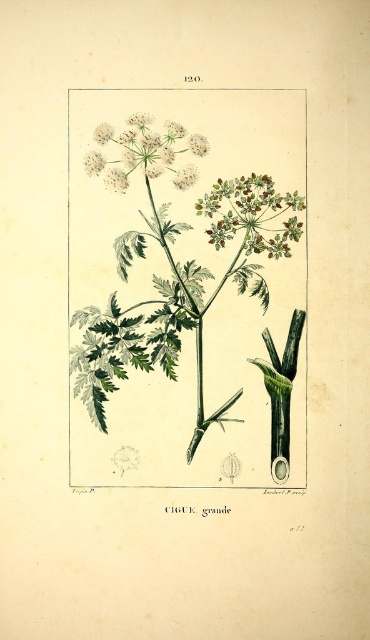
Question: Does green textured flower at upper center have a lesser width compared to white fluffy flower at upper center?

Choices:
 (A) yes
 (B) no

Answer: (A)

Question: Among these points, which one is farthest from the camera?

Choices:
 (A) (256, 243)
 (B) (146, 160)

Answer: (A)

Question: Is green textured flower at upper center positioned at the back of white fluffy flower at upper center?

Choices:
 (A) no
 (B) yes

Answer: (B)

Question: Which point is closer to the camera?

Choices:
 (A) (219, 179)
 (B) (216, 266)

Answer: (A)

Question: Which object appears farthest from the camera in this image?

Choices:
 (A) green textured flower at upper center
 (B) white fluffy flower at upper center
 (C) green leafy plant at center

Answer: (A)

Question: Does green textured flower at upper center appear on the left side of white fluffy flower at upper center?

Choices:
 (A) yes
 (B) no

Answer: (B)